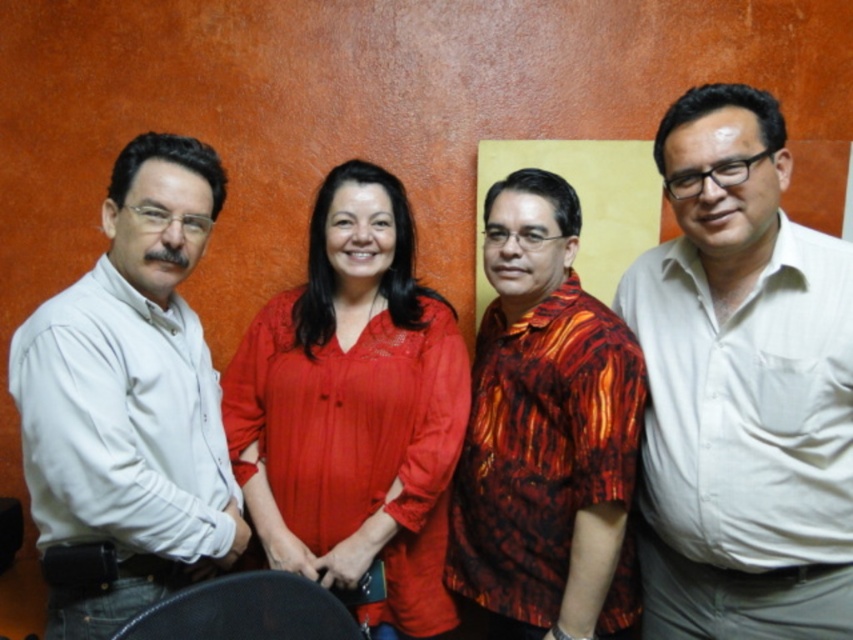
Question: Which object is the farthest from the white cotton shirt at right?

Choices:
 (A) reddish-brown patterned shirt at center
 (B) matte red blouse at center

Answer: (B)

Question: Does white cotton shirt at right appear on the right side of white matte shirt at left?

Choices:
 (A) yes
 (B) no

Answer: (A)

Question: Which object appears farthest from the camera in this image?

Choices:
 (A) matte red blouse at center
 (B) white cotton shirt at right
 (C) reddish-brown patterned shirt at center
 (D) white matte shirt at left

Answer: (A)

Question: Which point is closer to the camera?

Choices:
 (A) (33, 508)
 (B) (665, 612)

Answer: (A)

Question: Is white cotton shirt at right above white matte shirt at left?

Choices:
 (A) no
 (B) yes

Answer: (A)

Question: Does white cotton shirt at right appear under reddish-brown patterned shirt at center?

Choices:
 (A) no
 (B) yes

Answer: (A)